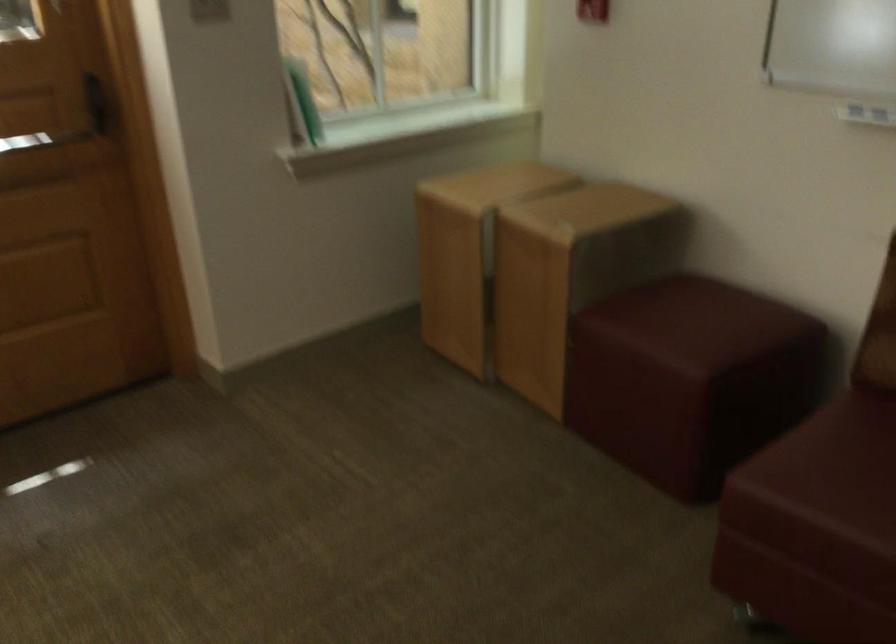
I want to click on black door handle, so click(x=96, y=102).